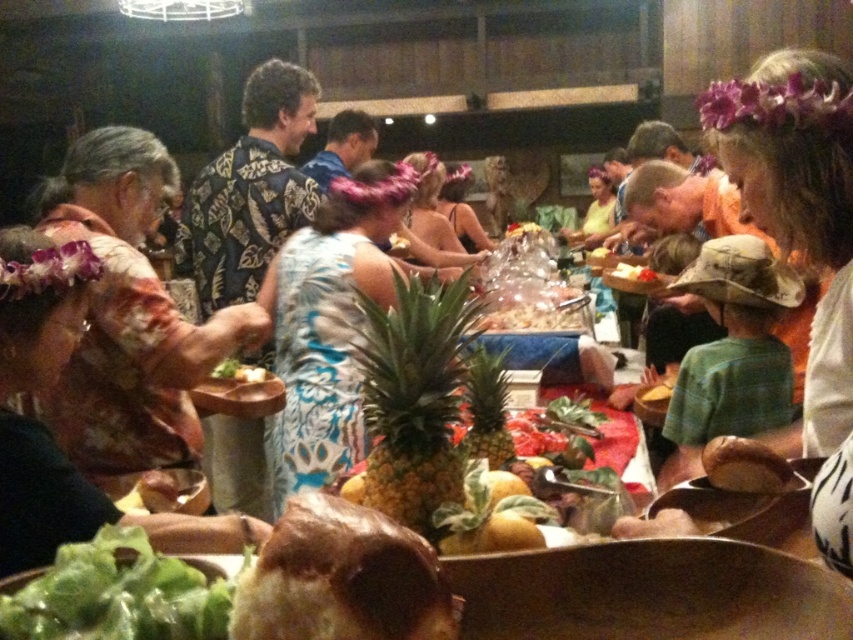
Question: Which point is closer to the camera?

Choices:
 (A) golden brown bread at lower right
 (B) yellow cheese at center
 (C) green leafy lettuce at lower left

Answer: (C)

Question: Based on their relative distances, which object is farther from the translucent plastic container at center?

Choices:
 (A) green leafy lettuce at lower left
 (B) brown crispy bread at center
 (C) yellow cheese at center
 (D) printed fabric shirt at left

Answer: (B)

Question: Observing the image, what is the correct spatial positioning of printed fabric shirt at left in reference to green leafy vegetable at center?

Choices:
 (A) below
 (B) above

Answer: (B)

Question: Can you confirm if brown crispy bread at center is bigger than yellow pineapple at center?

Choices:
 (A) no
 (B) yes

Answer: (A)

Question: Which is nearer to the printed fabric shirt at left?

Choices:
 (A) green cotton shirt at right
 (B) brown crispy bread at center
 (C) translucent plastic container at center

Answer: (A)

Question: Can you confirm if green leafy lettuce at lower left is wider than translucent plastic container at center?

Choices:
 (A) no
 (B) yes

Answer: (A)